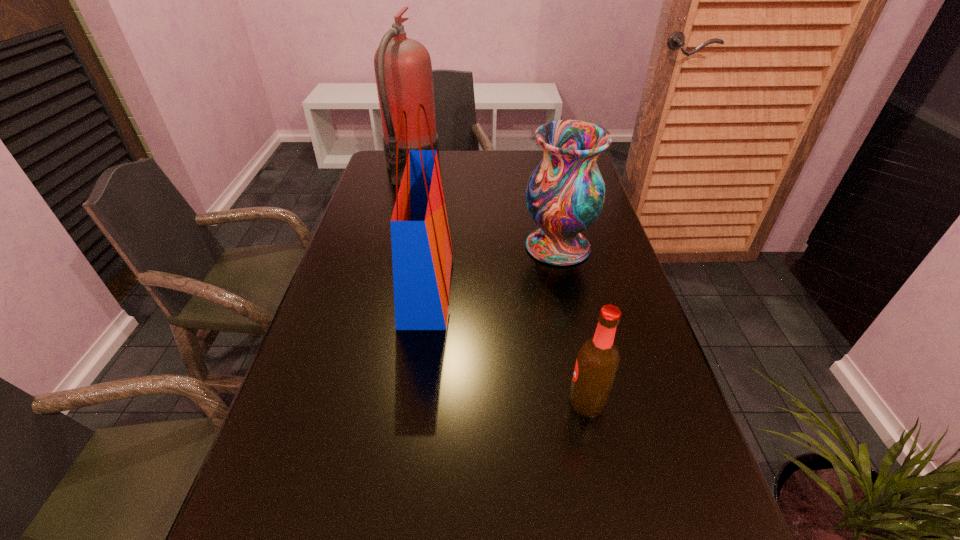
Where is `object that is at the left edge`? Image resolution: width=960 pixels, height=540 pixels. object that is at the left edge is located at coordinates (403, 70).

Locate an element on the screen. vase located at the right edge is located at coordinates (565, 194).

The height and width of the screenshot is (540, 960). I want to click on beer bottle located in the right edge section of the desktop, so click(597, 362).

Identify the location of object present at the far left corner. The height and width of the screenshot is (540, 960). (403, 70).

This screenshot has height=540, width=960. Find the location of `vacant space at the far edge`. vacant space at the far edge is located at coordinates (481, 156).

I want to click on vacant region at the left edge of the desktop, so click(x=353, y=435).

Locate an element on the screen. free space between the third tallest object and the fire extinguisher is located at coordinates (485, 207).

Identify the location of vacant area that lies between the second shortest object and the beer bottle. This screenshot has width=960, height=540. (572, 324).

Image resolution: width=960 pixels, height=540 pixels. In order to click on free space between the second shortest object and the shopping bag in this screenshot , I will do `click(492, 266)`.

Find the location of a particular element. The image size is (960, 540). free space that is in between the shopping bag and the vase is located at coordinates (492, 266).